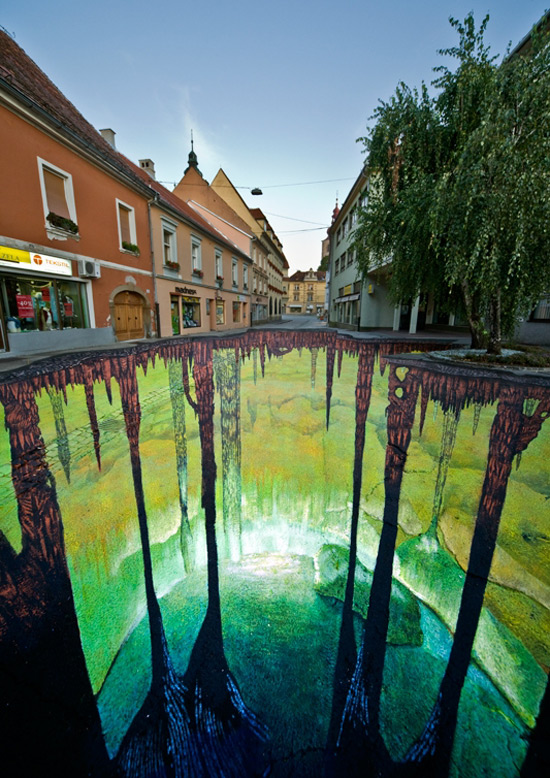
The height and width of the screenshot is (778, 550). Identify the location of chimneys. (148, 163), (110, 135).